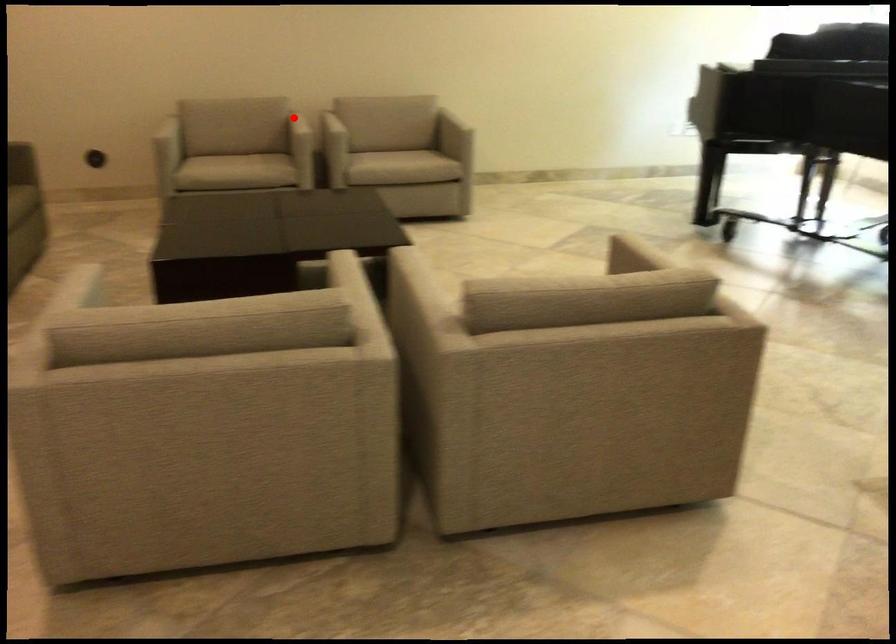
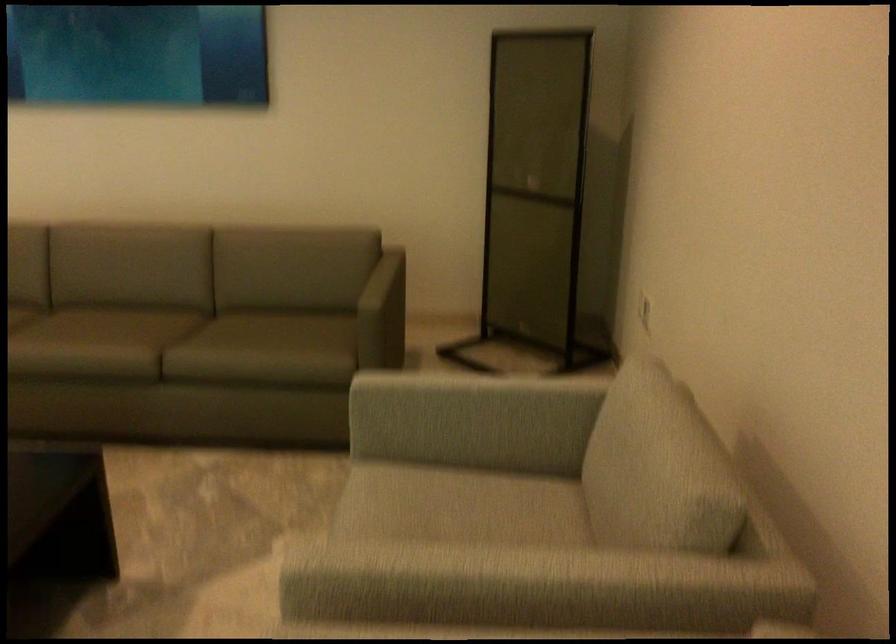
Question: I am providing you with two images of the same scene from different viewpoints. A red point is shown in image1. For the corresponding object point in image2, is it positioned nearer or farther from the camera?

Choices:
 (A) Nearer
 (B) Farther

Answer: (A)